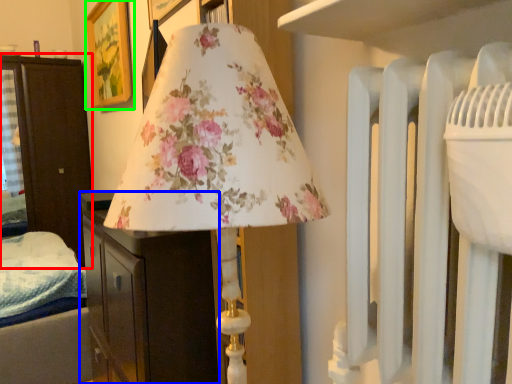
Question: Estimate the real-world distances between objects in this image. Which object is closer to furniture (highlighted by a red box), furniture (highlighted by a blue box) or picture frame (highlighted by a green box)?

Choices:
 (A) furniture
 (B) picture frame

Answer: (B)